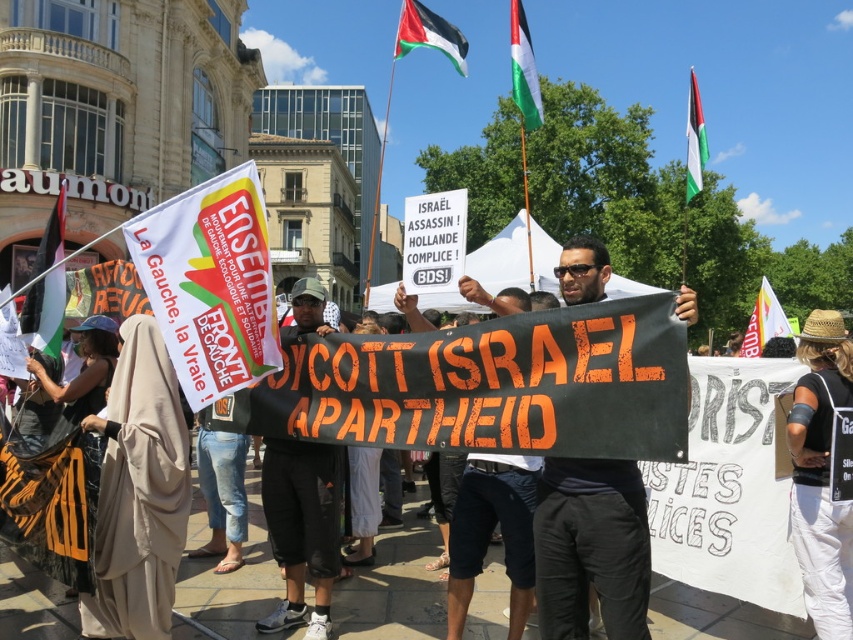
Question: Does green and white fabric flag at upper center appear on the left side of white paper flag at upper right?

Choices:
 (A) yes
 (B) no

Answer: (A)

Question: From the image, what is the correct spatial relationship of white fabric banner at left in relation to beige fabric headscarf at lower left?

Choices:
 (A) right
 (B) left

Answer: (A)

Question: Estimate the real-world distances between objects in this image. Which object is farther from the palestinian flag at left?

Choices:
 (A) black cotton shorts at center
 (B) green and white fabric flag at upper center
 (C) white fabric banner at left

Answer: (B)

Question: Among these objects, which one is nearest to the camera?

Choices:
 (A) green and white fabric flag at upper center
 (B) palestinian flag at left
 (C) black cotton shorts at center

Answer: (C)

Question: Considering the real-world distances, which object is farthest from the green and white fabric flag at upper center?

Choices:
 (A) black cotton shorts at center
 (B) white canvas sign at lower right
 (C) palestinian flag at upper right

Answer: (B)

Question: Is beige fabric headscarf at lower left smaller than palestinian flag at upper right?

Choices:
 (A) yes
 (B) no

Answer: (A)